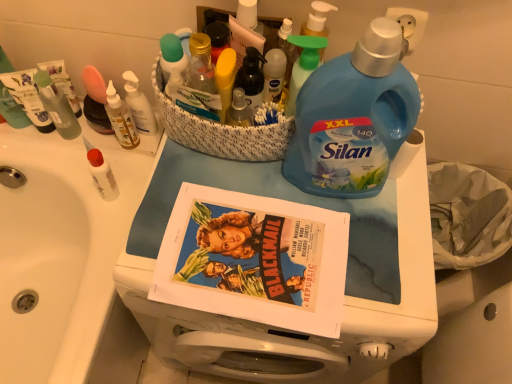
Where is `free space to the left of white matte bottle at left, the first toiletry viewed from the left`? The height and width of the screenshot is (384, 512). free space to the left of white matte bottle at left, the first toiletry viewed from the left is located at coordinates (61, 165).